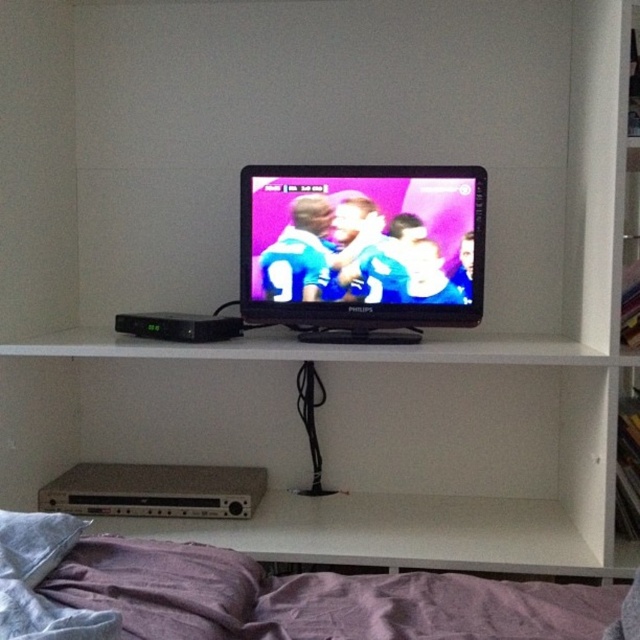
Question: Which point is farther to the camera?

Choices:
 (A) matte black tv at center
 (B) purple fabric bed at lower center

Answer: (A)

Question: Is purple fabric bed at lower center in front of matte black tv at center?

Choices:
 (A) yes
 (B) no

Answer: (A)

Question: Can you confirm if purple fabric bed at lower center is wider than matte black tv at center?

Choices:
 (A) yes
 (B) no

Answer: (A)

Question: Can you confirm if purple fabric bed at lower center is positioned above matte black tv at center?

Choices:
 (A) yes
 (B) no

Answer: (B)